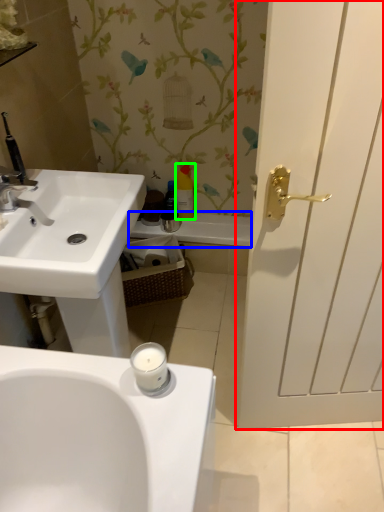
Question: Considering the real-world distances, which object is closest to door (highlighted by a red box)? bath (highlighted by a blue box) or toiletry (highlighted by a green box).

Choices:
 (A) bath
 (B) toiletry

Answer: (A)